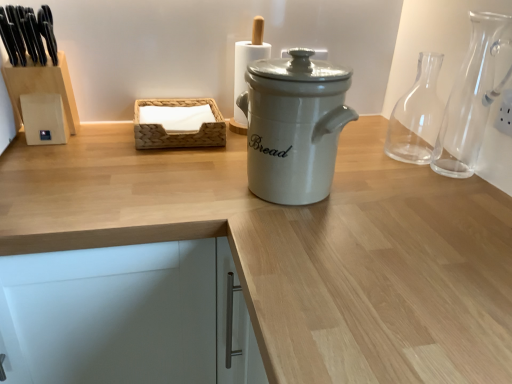
Question: Is woven wood tissue box at center at the back of transparent glass carafe at right, the 1th glass vase in the front-to-back sequence?

Choices:
 (A) no
 (B) yes

Answer: (A)

Question: Is the depth of transparent glass carafe at right, the 1th glass vase in the front-to-back sequence, less than that of woven wood tissue box at center?

Choices:
 (A) yes
 (B) no

Answer: (A)

Question: From a real-world perspective, is transparent glass carafe at right, the 1th glass vase in the front-to-back sequence, positioned over woven wood tissue box at center based on gravity?

Choices:
 (A) yes
 (B) no

Answer: (A)

Question: Considering the relative sizes of transparent glass carafe at right, positioned as the 2th glass vase in back-to-front order, and woven wood tissue box at center in the image provided, is transparent glass carafe at right, positioned as the 2th glass vase in back-to-front order, smaller than woven wood tissue box at center?

Choices:
 (A) yes
 (B) no

Answer: (B)

Question: Is the surface of transparent glass carafe at right, the 1th glass vase in the front-to-back sequence, in direct contact with woven wood tissue box at center?

Choices:
 (A) yes
 (B) no

Answer: (B)

Question: From the image's perspective, is transparent glass carafe at right, acting as the 2th glass vase starting from the front, located above or below white plastic electric outlet at upper right?

Choices:
 (A) above
 (B) below

Answer: (A)

Question: Considering the relative positions of transparent glass carafe at right, acting as the 2th glass vase starting from the front, and white plastic electric outlet at upper right in the image provided, is transparent glass carafe at right, acting as the 2th glass vase starting from the front, to the left or to the right of white plastic electric outlet at upper right?

Choices:
 (A) left
 (B) right

Answer: (A)

Question: In terms of height, does transparent glass carafe at right, the 1th glass vase when ordered from back to front, look taller or shorter compared to white plastic electric outlet at upper right?

Choices:
 (A) tall
 (B) short

Answer: (A)

Question: Based on their sizes in the image, would you say transparent glass carafe at right, the 1th glass vase when ordered from back to front, is bigger or smaller than white plastic electric outlet at upper right?

Choices:
 (A) big
 (B) small

Answer: (A)

Question: From the image's perspective, relative to white plastic electric outlet at upper right, is woven wood tissue box at center above or below?

Choices:
 (A) below
 (B) above

Answer: (B)

Question: Considering the relative positions of woven wood tissue box at center and white plastic electric outlet at upper right in the image provided, is woven wood tissue box at center to the left or to the right of white plastic electric outlet at upper right?

Choices:
 (A) right
 (B) left

Answer: (B)

Question: Considering their positions, is woven wood tissue box at center located in front of or behind white plastic electric outlet at upper right?

Choices:
 (A) front
 (B) behind

Answer: (B)

Question: Is point (137, 110) closer or farther from the camera than point (510, 100)?

Choices:
 (A) farther
 (B) closer

Answer: (A)

Question: Considering their positions, is white ceramic bread bin at center located in front of or behind white matte cabinet at lower left?

Choices:
 (A) front
 (B) behind

Answer: (B)

Question: From the image's perspective, is white ceramic bread bin at center located above or below white matte cabinet at lower left?

Choices:
 (A) below
 (B) above

Answer: (B)